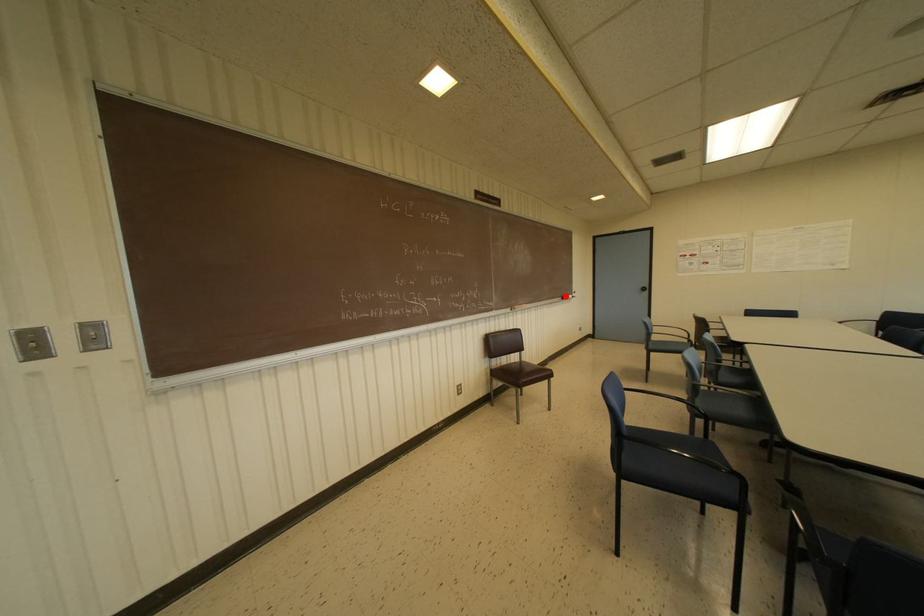
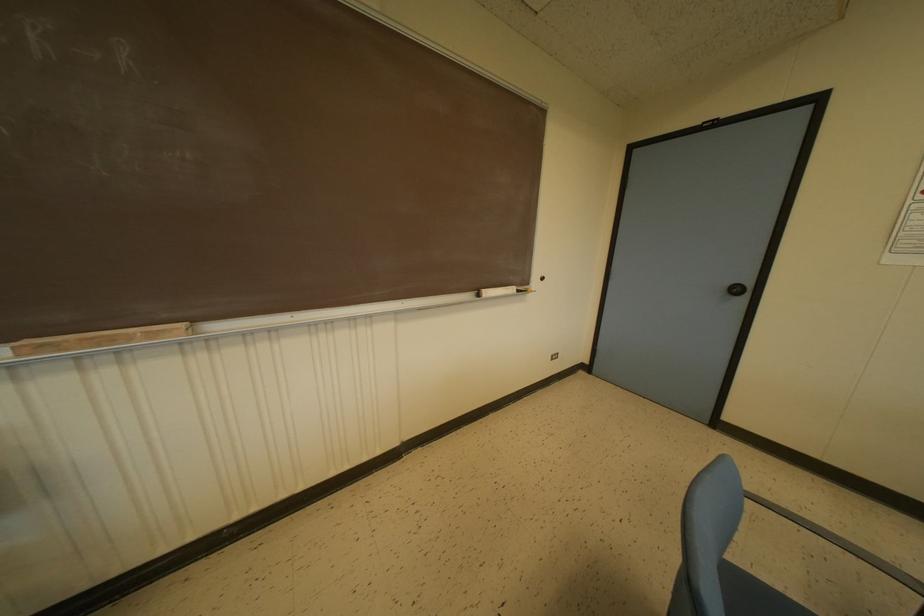
Find the pixel in the second image that matches the highlighted location in the first image.

(487, 292)